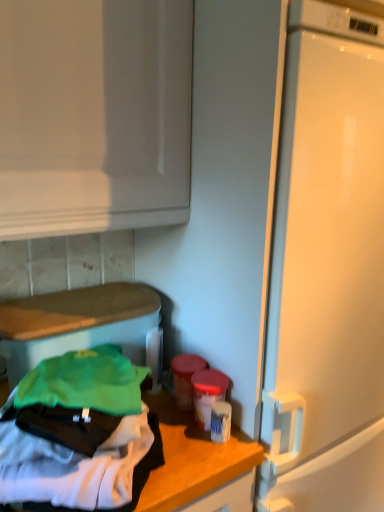
Identify the location of free location above matte green fabric at lower left (from a real-world perspective). This screenshot has height=512, width=384. (83, 300).